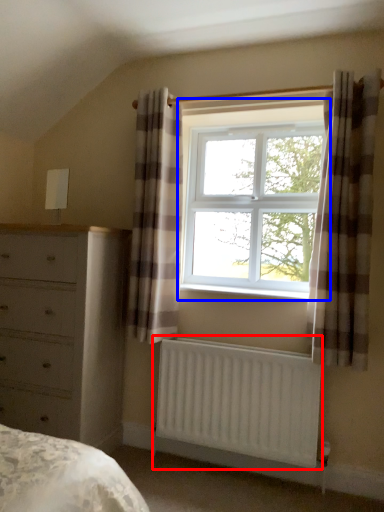
Question: Which object appears closest to the camera in this image, radiator (highlighted by a red box) or window (highlighted by a blue box)?

Choices:
 (A) radiator
 (B) window

Answer: (A)